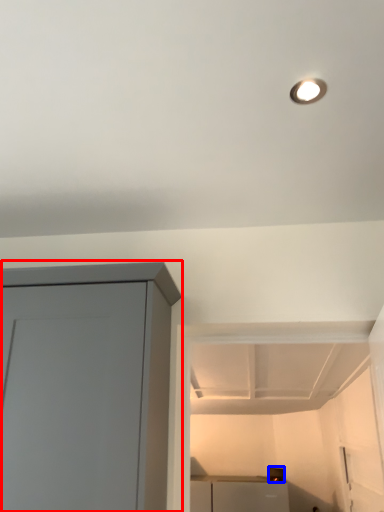
Question: Among these objects, which one is nearest to the camera, cupboard (highlighted by a red box) or appliance (highlighted by a blue box)?

Choices:
 (A) cupboard
 (B) appliance

Answer: (A)